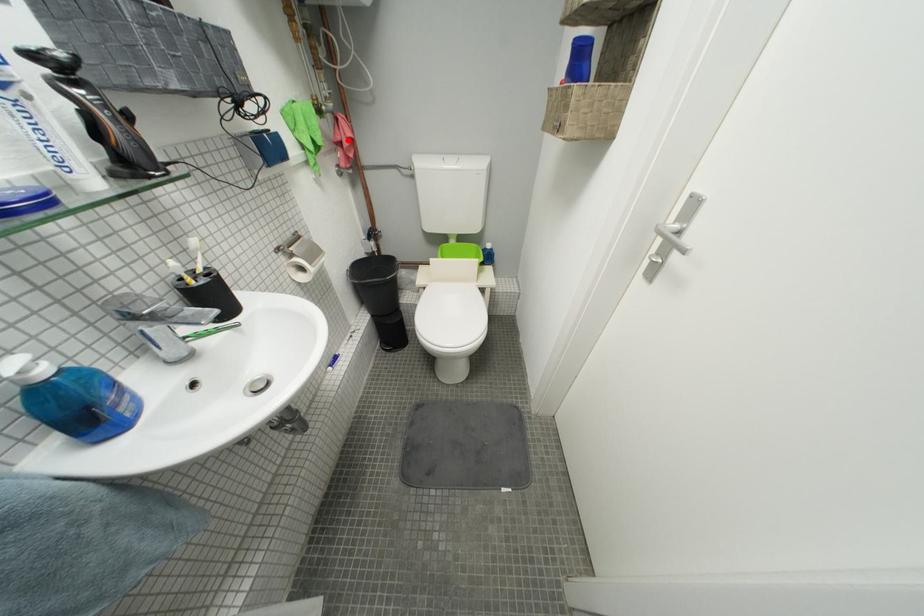
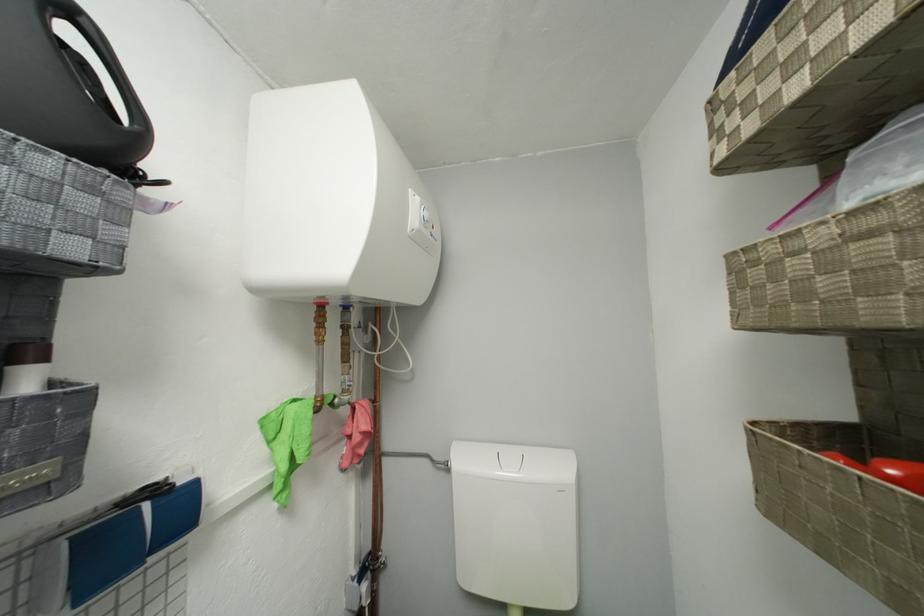
The point at the highlighted location is marked in the first image. Where is the corresponding point in the second image?

(358, 435)